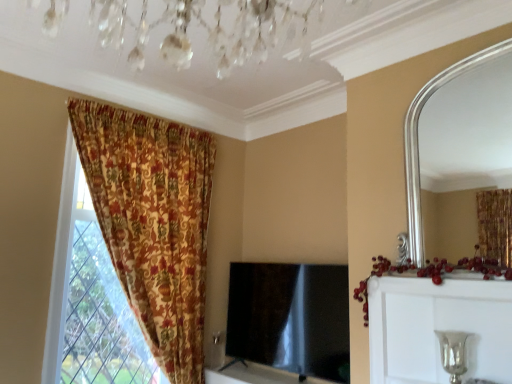
Question: Is silver/metallic mirror at upper right in front of or behind black glossy tv at center in the image?

Choices:
 (A) behind
 (B) front

Answer: (B)

Question: Considering the positions of point (446, 92) and point (249, 342), is point (446, 92) closer or farther from the camera than point (249, 342)?

Choices:
 (A) closer
 (B) farther

Answer: (B)

Question: Which of these objects is positioned closest to the black glossy tv at center?

Choices:
 (A) silver metallic candle holder at lower right
 (B) silver/metallic mirror at upper right
 (C) silver metallic vase at upper right
 (D) floral fabric curtain at left

Answer: (D)

Question: Estimate the real-world distances between objects in this image. Which object is farther from the silver/metallic mirror at upper right?

Choices:
 (A) silver metallic vase at upper right
 (B) black glossy tv at center
 (C) silver metallic candle holder at lower right
 (D) floral fabric curtain at left

Answer: (C)